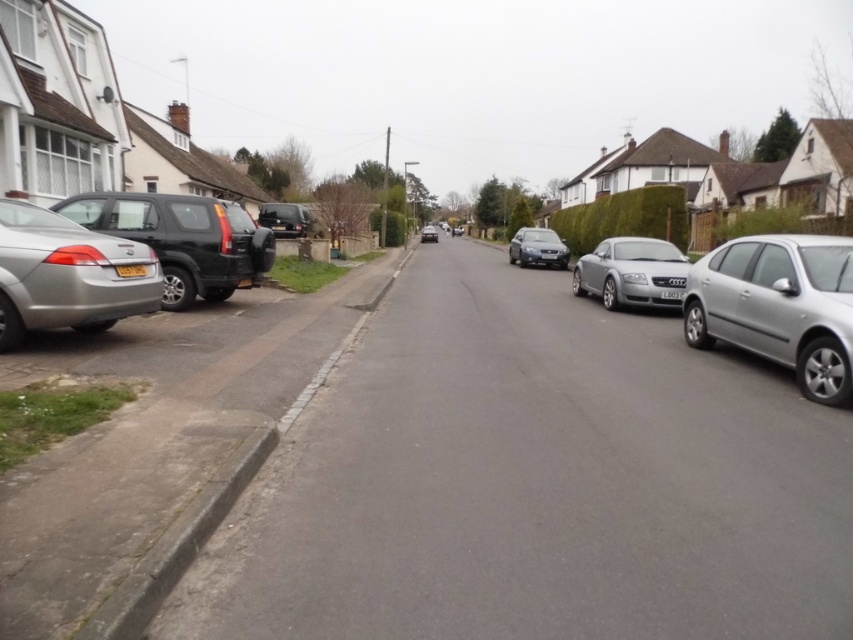
Who is higher up, shiny black suv at left or yellow matte license plate at center?

shiny black suv at left is above.

Locate an element on the screen. This screenshot has height=640, width=853. shiny black suv at left is located at coordinates (247, 243).

Does point (601, 272) lie behind point (129, 269)?

Yes, point (601, 272) is behind point (129, 269).

Does satin silver car at center have a lesser width compared to yellow matte license plate at center?

In fact, satin silver car at center might be wider than yellow matte license plate at center.

Where is `satin silver car at center`? satin silver car at center is located at coordinates tap(631, 272).

Where is `satin silver car at center`? satin silver car at center is located at coordinates (631, 272).

Who is positioned more to the right, matte black suv at left or satin silver sedan at center?

satin silver sedan at center is more to the right.

Is matte black suv at left closer to the viewer compared to satin silver sedan at center?

Yes, it is in front of satin silver sedan at center.

Measure the distance between matte black suv at left and camera.

matte black suv at left is 23.03 feet away from camera.

At what (x,y) coordinates should I click in order to perform the action: click on matte black suv at left. Please return your answer as a coordinate pair (x, y). This screenshot has width=853, height=640. Looking at the image, I should click on (183, 240).